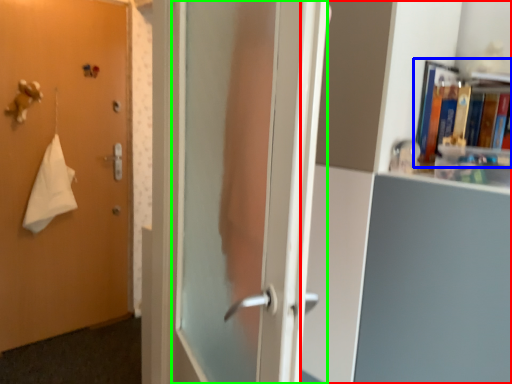
Question: Estimate the real-world distances between objects in this image. Which object is farther from bookcase (highlighted by a red box), book (highlighted by a blue box) or screen door (highlighted by a green box)?

Choices:
 (A) book
 (B) screen door

Answer: (B)